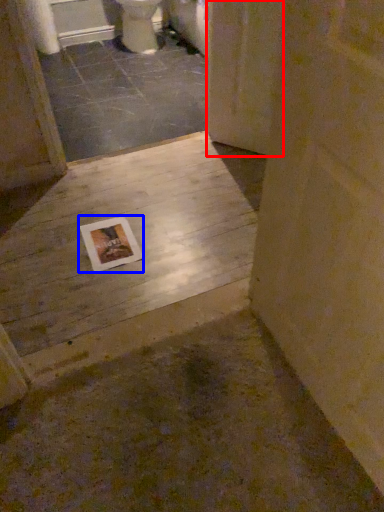
Question: Which of the following is the closest to the observer, screen door (highlighted by a red box) or postcard (highlighted by a blue box)?

Choices:
 (A) screen door
 (B) postcard

Answer: (B)